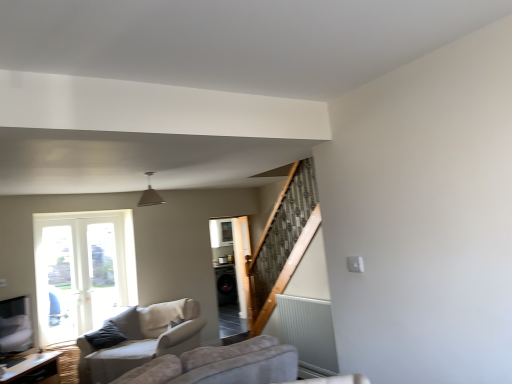
Where is `matte gray pendant light at center`? Image resolution: width=512 pixels, height=384 pixels. matte gray pendant light at center is located at coordinates (150, 194).

Find the location of a particular element. This screenshot has height=384, width=512. wooden table at lower left is located at coordinates (34, 370).

Is matte gray pendant light at center completely or partially inside black glossy screen door at center?

No.

Is black glossy screen door at center aimed at matte gray pendant light at center?

No, black glossy screen door at center is not aimed at matte gray pendant light at center.

From the image's perspective, between black glossy screen door at center and matte gray pendant light at center, who is located below?

black glossy screen door at center is shown below in the image.

How different are the orientations of black glossy screen door at center and matte gray pendant light at center in degrees?

8.06 degrees.

From a real-world perspective, which is physically above, beige fabric couch at lower left or matte gray pendant light at center?

matte gray pendant light at center is physically above.

Measure the distance between beige fabric couch at lower left and matte gray pendant light at center.

The distance of beige fabric couch at lower left from matte gray pendant light at center is 1.58 meters.

From the image's perspective, which one is positioned higher, beige fabric couch at lower left or matte gray pendant light at center?

matte gray pendant light at center, from the image's perspective.

Would you say beige fabric couch at lower left is to the left or to the right of matte gray pendant light at center in the picture?

Based on their positions, beige fabric couch at lower left is located to the left of matte gray pendant light at center.

Is matte gray pendant light at center facing towards black glossy screen door at center?

No, matte gray pendant light at center does not turn towards black glossy screen door at center.

Considering the relative sizes of matte gray pendant light at center and black glossy screen door at center in the image provided, is matte gray pendant light at center taller than black glossy screen door at center?

Incorrect, the height of matte gray pendant light at center is not larger of that of black glossy screen door at center.

Based on their sizes in the image, would you say matte gray pendant light at center is bigger or smaller than black glossy screen door at center?

matte gray pendant light at center is smaller than black glossy screen door at center.

Considering the positions of point (133, 311) and point (212, 236), is point (133, 311) closer or farther from the camera than point (212, 236)?

Point (133, 311) is closer to the camera than point (212, 236).

Does beige fabric couch at lower left appear on the right side of black glossy screen door at center?

No, beige fabric couch at lower left is not to the right of black glossy screen door at center.

Can you tell me how much beige fabric couch at lower left and black glossy screen door at center differ in facing direction?

132 degrees separate the facing orientations of beige fabric couch at lower left and black glossy screen door at center.

Consider the image. Can we say beige fabric couch at lower left lies outside black glossy screen door at center?

beige fabric couch at lower left lies outside black glossy screen door at center's area.

From a real-world perspective, between wooden table at lower left and black glossy screen door at center, who is vertically higher?

black glossy screen door at center is physically above.

Based on the photo, based on their positions, is wooden table at lower left located to the left or right of black glossy screen door at center?

In the image, wooden table at lower left appears on the left side of black glossy screen door at center.

I want to click on screen door that appears above the wooden table at lower left (from a real-world perspective), so click(x=230, y=270).

What's the angular difference between wooden table at lower left and black glossy screen door at center's facing directions?

There is a 132-degree angle between the facing directions of wooden table at lower left and black glossy screen door at center.

Is the position of wooden table at lower left more distant than that of matte gray pendant light at center?

No, it is in front of matte gray pendant light at center.

Which is farther from the camera, [44,353] or [148,180]?

The point [44,353] is behind.

From the image's perspective, which one is positioned higher, wooden table at lower left or matte gray pendant light at center?

matte gray pendant light at center, from the image's perspective.

Considering the sizes of objects black glossy screen door at center and wooden table at lower left in the image provided, who is wider, black glossy screen door at center or wooden table at lower left?

With larger width is wooden table at lower left.

Consider the image. Choose the correct answer: Is black glossy screen door at center inside wooden table at lower left or outside it?

black glossy screen door at center exists outside the volume of wooden table at lower left.

From a real-world perspective, is black glossy screen door at center located higher than wooden table at lower left?

Yes, from a real-world perspective, black glossy screen door at center is on top of wooden table at lower left.

Which point is more distant from viewer, (232,320) or (27,362)?

The point (232,320) is farther from the camera.

Find the location of a particular element. light fixture on the left side of black glossy screen door at center is located at coordinates (150, 194).

Locate an element on the screen. This screenshot has height=384, width=512. studio couch that appears behind the matte gray pendant light at center is located at coordinates (141, 340).

From the image, which object appears to be farther from beige fabric couch at lower left, wooden table at lower left or black glossy screen door at center?

The object further to beige fabric couch at lower left is wooden table at lower left.

Estimate the real-world distances between objects in this image. Which object is closer to matte gray pendant light at center, black glossy screen door at center or wooden table at lower left?

Among the two, black glossy screen door at center is located nearer to matte gray pendant light at center.

From the image, which object appears to be nearer to black glossy screen door at center, wooden table at lower left or matte gray pendant light at center?

The object closer to black glossy screen door at center is matte gray pendant light at center.

From the image, which object appears to be farther from beige fabric couch at lower left, black glossy screen door at center or matte gray pendant light at center?

The object further to beige fabric couch at lower left is matte gray pendant light at center.

Looking at the image, which one is located further to beige fabric couch at lower left, matte gray pendant light at center or wooden table at lower left?

matte gray pendant light at center.

From the image, which object appears to be nearer to wooden table at lower left, matte gray pendant light at center or black glossy screen door at center?

Based on the image, black glossy screen door at center appears to be nearer to wooden table at lower left.

Looking at the image, which one is located further to wooden table at lower left, black glossy screen door at center or beige fabric couch at lower left?

Based on the image, black glossy screen door at center appears to be further to wooden table at lower left.

When comparing their distances from beige fabric couch at lower left, does black glossy screen door at center or wooden table at lower left seem closer?

Among the two, black glossy screen door at center is located nearer to beige fabric couch at lower left.

What are the coordinates of `studio couch between matte gray pendant light at center and wooden table at lower left in the vertical direction` in the screenshot? It's located at (141, 340).

Identify the location of studio couch located between matte gray pendant light at center and black glossy screen door at center in the depth direction. pos(141,340).

Image resolution: width=512 pixels, height=384 pixels. Find the location of `studio couch between wooden table at lower left and black glossy screen door at center along the z-axis`. studio couch between wooden table at lower left and black glossy screen door at center along the z-axis is located at coordinates (141, 340).

At what (x,y) coordinates should I click in order to perform the action: click on light fixture between wooden table at lower left and black glossy screen door at center in the front-back direction. Please return your answer as a coordinate pair (x, y). Looking at the image, I should click on (150, 194).